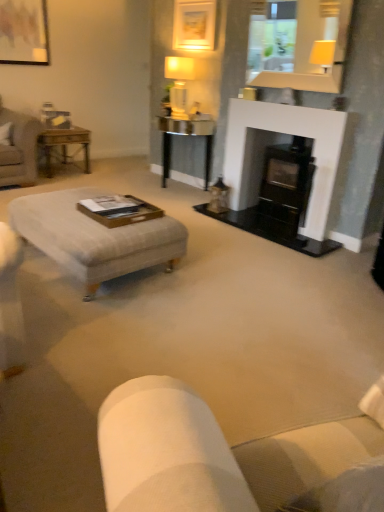
Question: Does matte glass mirror at upper center have a greater height compared to matte wooden picture frame at upper left, placed as the 1th picture frame when sorted from left to right?

Choices:
 (A) no
 (B) yes

Answer: (A)

Question: Is matte glass mirror at upper center to the right of matte wooden picture frame at upper left, placed as the 1th picture frame when sorted from left to right, from the viewer's perspective?

Choices:
 (A) no
 (B) yes

Answer: (B)

Question: Is matte glass mirror at upper center positioned with its back to matte wooden picture frame at upper left, placed as the 1th picture frame when sorted from left to right?

Choices:
 (A) no
 (B) yes

Answer: (A)

Question: Does matte glass mirror at upper center have a lesser width compared to matte wooden picture frame at upper left, placed as the 1th picture frame when sorted from left to right?

Choices:
 (A) yes
 (B) no

Answer: (B)

Question: Considering the relative sizes of matte glass mirror at upper center and matte wooden picture frame at upper left, placed as the second picture frame when sorted from right to left, in the image provided, is matte glass mirror at upper center shorter than matte wooden picture frame at upper left, placed as the second picture frame when sorted from right to left,?

Choices:
 (A) yes
 (B) no

Answer: (A)

Question: Is matte glass mirror at upper center outside matte wooden picture frame at upper left, placed as the second picture frame when sorted from right to left?

Choices:
 (A) no
 (B) yes

Answer: (B)

Question: Would you consider light gray fabric ottoman at center to be distant from matte glass mirror at upper center?

Choices:
 (A) yes
 (B) no

Answer: (A)

Question: From a real-world perspective, is light gray fabric ottoman at center beneath matte glass mirror at upper center?

Choices:
 (A) no
 (B) yes

Answer: (B)

Question: Is light gray fabric ottoman at center not inside matte glass mirror at upper center?

Choices:
 (A) no
 (B) yes

Answer: (B)

Question: Is light gray fabric ottoman at center to the left of matte glass mirror at upper center from the viewer's perspective?

Choices:
 (A) no
 (B) yes

Answer: (B)

Question: Is light gray fabric ottoman at center taller than matte glass mirror at upper center?

Choices:
 (A) no
 (B) yes

Answer: (A)

Question: From a real-world perspective, is light gray fabric ottoman at center physically above matte glass mirror at upper center?

Choices:
 (A) yes
 (B) no

Answer: (B)

Question: Is matte gold picture frame at upper center, placed as the 2th picture frame when sorted from left to right, a part of matte white lamp at upper center?

Choices:
 (A) no
 (B) yes

Answer: (A)